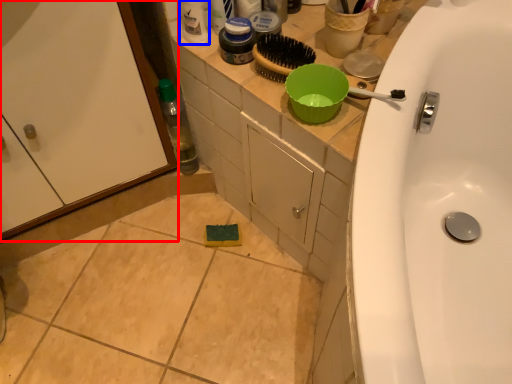
Question: Which object is further to the camera taking this photo, screen door (highlighted by a red box) or cleaning product (highlighted by a blue box)?

Choices:
 (A) screen door
 (B) cleaning product

Answer: (B)